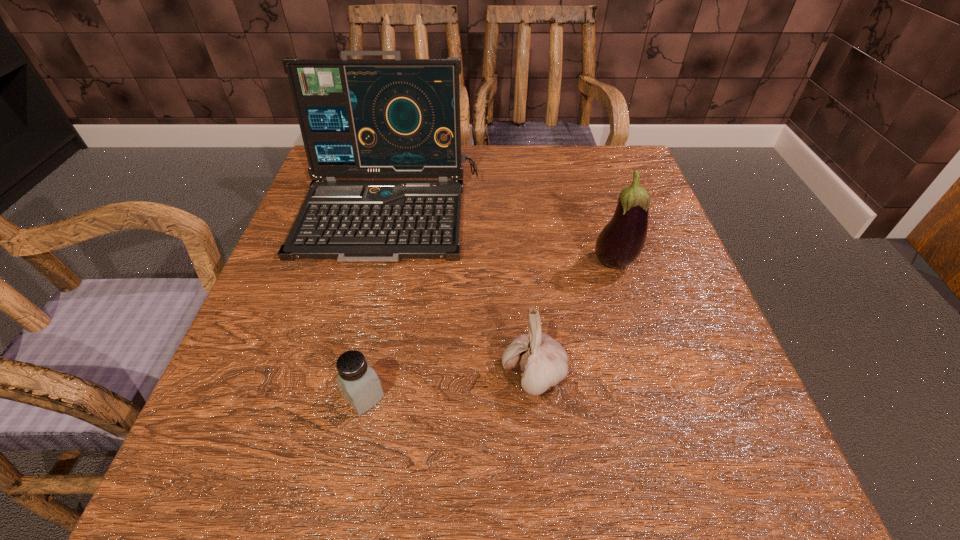
What are the coordinates of `free space between the rightmost object and the third object from left to right` in the screenshot? It's located at (573, 320).

Locate an element on the screen. free space that is in between the second object from right to left and the rightmost object is located at coordinates (573, 320).

The width and height of the screenshot is (960, 540). I want to click on vacant area that lies between the laptop computer and the shortest object, so click(x=376, y=305).

Image resolution: width=960 pixels, height=540 pixels. What are the coordinates of `vacant region between the eggplant and the garlic` in the screenshot? It's located at (573, 320).

This screenshot has height=540, width=960. Find the location of `unoccupied area between the shortest object and the tallest object`. unoccupied area between the shortest object and the tallest object is located at coordinates (376, 305).

Locate an element on the screen. vacant area that lies between the rightmost object and the garlic is located at coordinates (573, 320).

You are a GUI agent. You are given a task and a screenshot of the screen. Output one action in this format:
    pyautogui.click(x=<x>, y=<y>)
    Task: Click on the free space between the tallest object and the second tallest object
    This screenshot has width=960, height=540.
    Given the screenshot: What is the action you would take?
    pyautogui.click(x=502, y=239)

Locate an element on the screen. empty space between the laptop computer and the second tallest object is located at coordinates (502, 239).

You are a GUI agent. You are given a task and a screenshot of the screen. Output one action in this format:
    pyautogui.click(x=<x>, y=<y>)
    Task: Click on the empty space that is in between the second tallest object and the third tallest object
    This screenshot has height=540, width=960.
    Given the screenshot: What is the action you would take?
    pyautogui.click(x=573, y=320)

Locate an element on the screen. Image resolution: width=960 pixels, height=540 pixels. vacant area between the rightmost object and the shortest object is located at coordinates (489, 330).